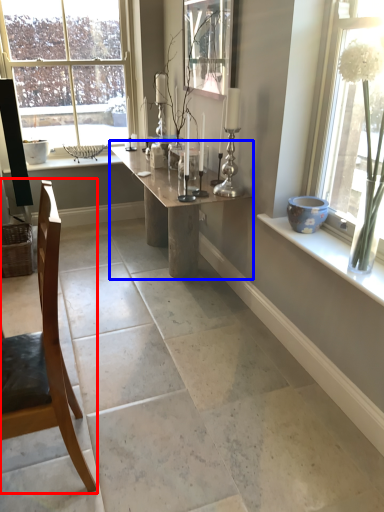
Question: Which of the following is the farthest to the observer, chair (highlighted by a red box) or table (highlighted by a blue box)?

Choices:
 (A) chair
 (B) table

Answer: (B)